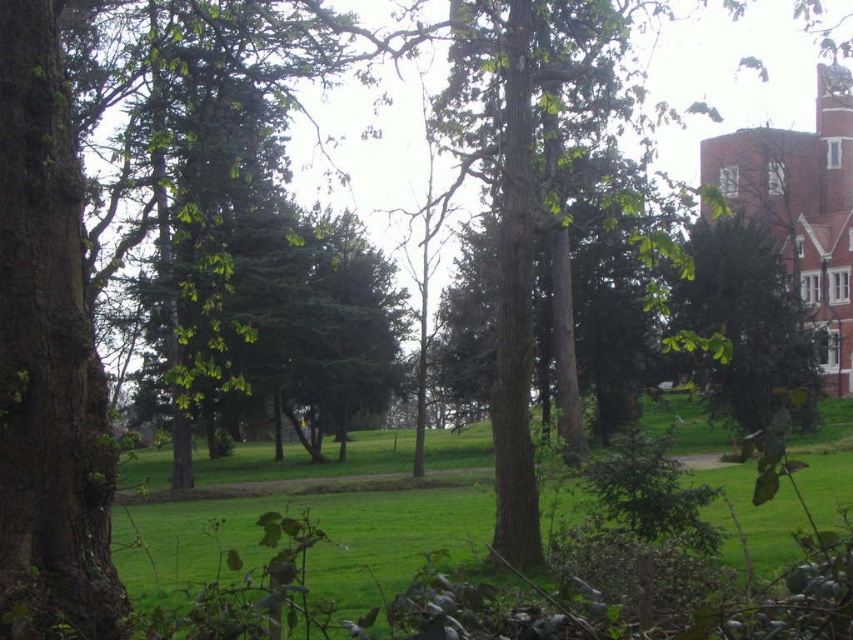
Which is more to the left, green grassy at center or green leafy tree at right?

Answer: Positioned to the left is green grassy at center.

Is green grassy at center closer to the viewer compared to green leafy tree at right?

That is False.

The image size is (853, 640). What do you see at coordinates (318, 516) in the screenshot?
I see `green grassy at center` at bounding box center [318, 516].

This screenshot has height=640, width=853. Identify the location of green grassy at center. (318, 516).